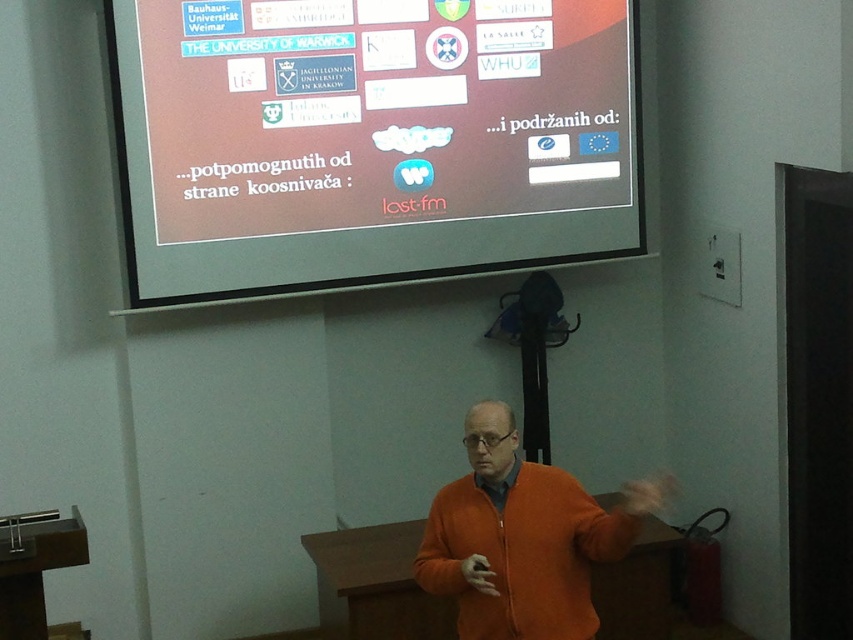
Question: Is matte plastic projection screen at upper center further to camera compared to orange zip-up sweater at center?

Choices:
 (A) no
 (B) yes

Answer: (B)

Question: Can you confirm if matte plastic projection screen at upper center is bigger than orange zip-up sweater at center?

Choices:
 (A) yes
 (B) no

Answer: (A)

Question: Which object is farther from the camera taking this photo?

Choices:
 (A) orange zip-up sweater at center
 (B) matte plastic projection screen at upper center

Answer: (B)

Question: Can you confirm if matte plastic projection screen at upper center is bigger than orange zip-up sweater at center?

Choices:
 (A) yes
 (B) no

Answer: (A)

Question: Which point is farther to the camera?

Choices:
 (A) (459, 493)
 (B) (281, 125)

Answer: (B)